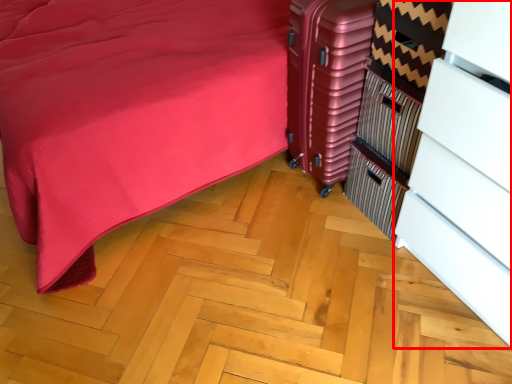
Question: From the image's perspective, what is the correct spatial positioning of dresser (annotated by the red box) in reference to luggage?

Choices:
 (A) above
 (B) below

Answer: (B)